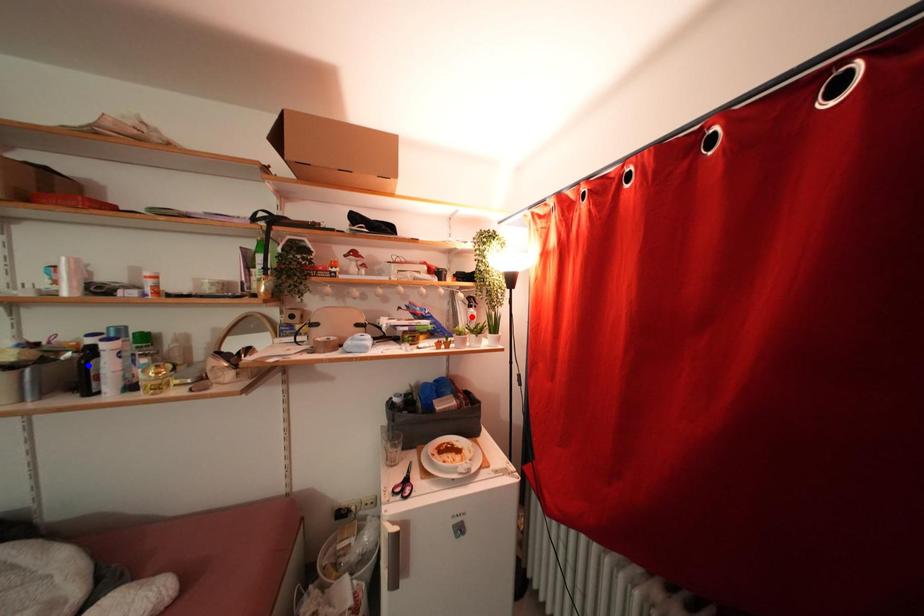
Question: Two points are marked on the image. Which point is closer to the camera?

Choices:
 (A) Blue point is closer.
 (B) Red point is closer.

Answer: (A)